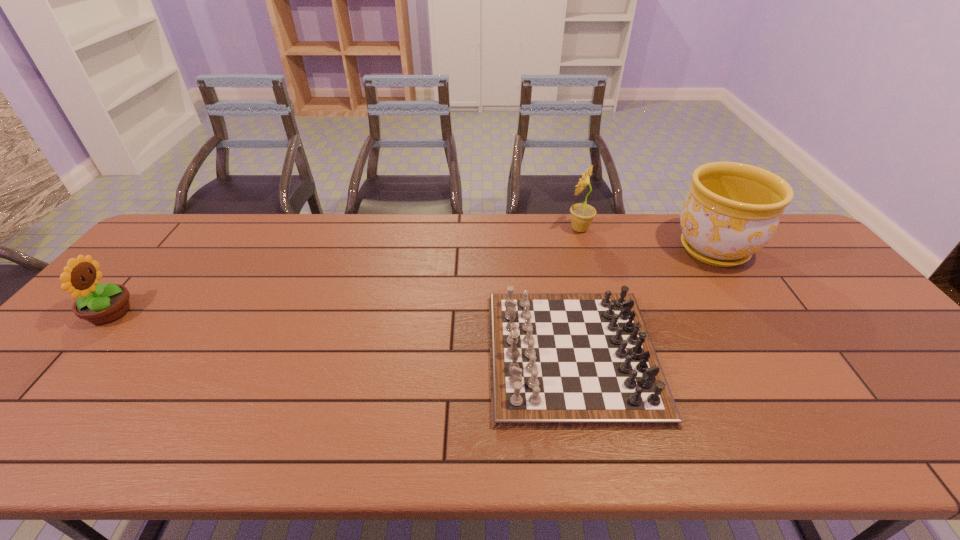
At what (x,y) coordinates should I click in order to perform the action: click on free spot between the shortest object and the leftmost object. Please return your answer as a coordinate pair (x, y). The image size is (960, 540). Looking at the image, I should click on coord(341,334).

The height and width of the screenshot is (540, 960). Find the location of `free spot between the taller sunflower and the shortest object`. free spot between the taller sunflower and the shortest object is located at coordinates (576, 292).

Locate which object ranks third in proximity to the nearer sunflower. Please provide its 2D coordinates. Your answer should be formatted as a tuple, i.e. [(x, y)], where the tuple contains the x and y coordinates of a point satisfying the conditions above.

[(732, 210)]

You are a GUI agent. You are given a task and a screenshot of the screen. Output one action in this format:
    pyautogui.click(x=<x>, y=<y>)
    Task: Click on the object that stands as the third closest to the farther sunflower
    Image resolution: width=960 pixels, height=540 pixels.
    Given the screenshot: What is the action you would take?
    pyautogui.click(x=100, y=304)

The image size is (960, 540). Find the location of `vacant position in the image that satisfies the following two spatial constraints: 1. on the face of the right sunflower; 2. on the back side of the rightmost object`. vacant position in the image that satisfies the following two spatial constraints: 1. on the face of the right sunflower; 2. on the back side of the rightmost object is located at coordinates (586, 249).